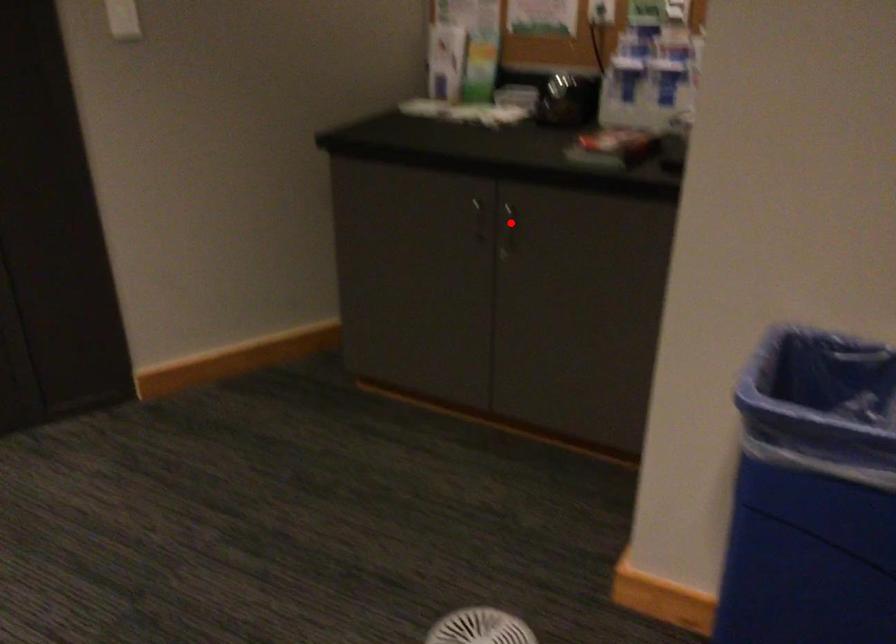
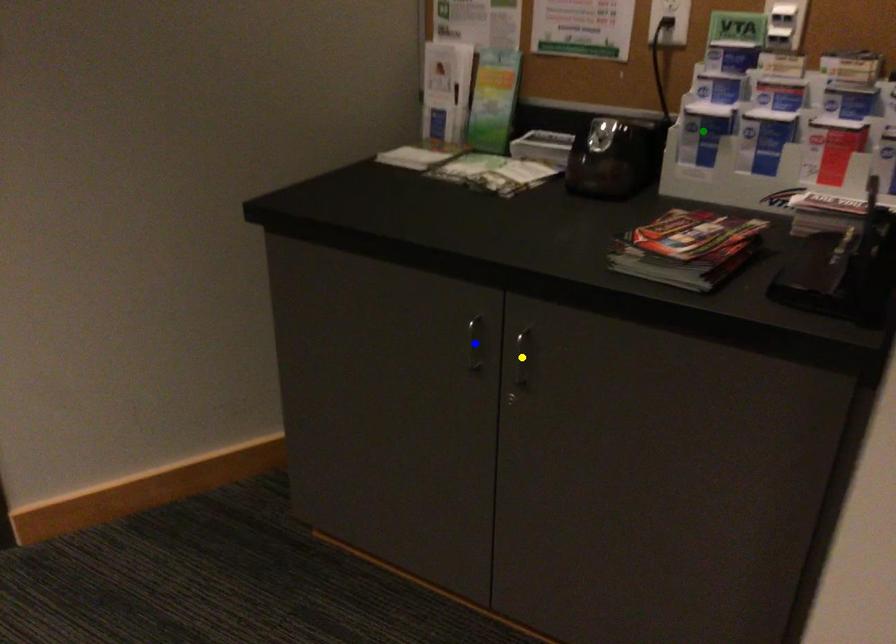
Question: I am providing you with two images of the same scene from different viewpoints. A red point is marked on the first image. You are given multiple points on the second image. Which mark in image 2 goes with the point in image 1?

Choices:
 (A) green point
 (B) blue point
 (C) yellow point

Answer: (C)